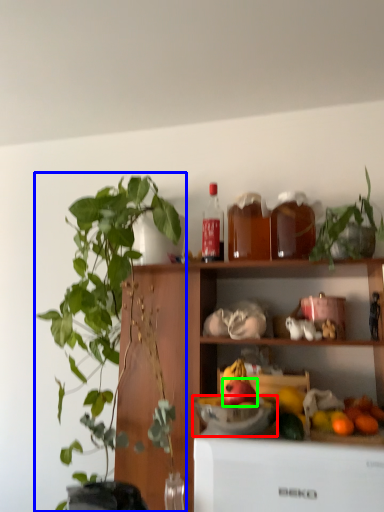
Question: Which object is positioned closest to bowl (highlighted by a red box)? Select from houseplant (highlighted by a blue box) and apple (highlighted by a green box).

Choices:
 (A) houseplant
 (B) apple

Answer: (B)